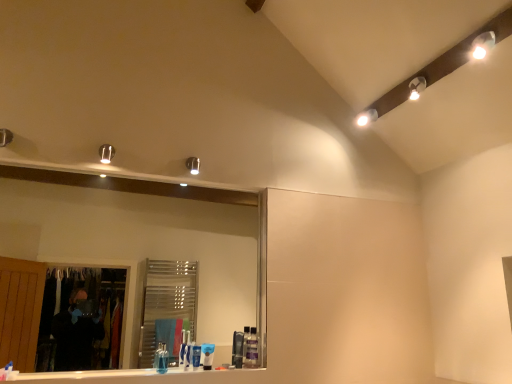
Question: From a real-world perspective, is translucent plastic container at lower center, placed as the first toiletry when sorted from right to left, physically located above or below white glossy light fixture at upper right?

Choices:
 (A) below
 (B) above

Answer: (A)

Question: Is translucent plastic container at lower center, which ranks as the fourth toiletry in left-to-right order, to the left or to the right of white glossy light fixture at upper right in the image?

Choices:
 (A) right
 (B) left

Answer: (B)

Question: Which object is the farthest from the white glossy toothpaste at lower left, marked as the second toothpaste in a back-to-front arrangement?

Choices:
 (A) white glossy toothpaste at lower center, arranged as the second toothpaste when viewed from the left
 (B) white glossy light fixture at upper right
 (C) blue glossy toothpaste tube at lower center, which is the 4th toiletry in right-to-left order
 (D) clear glass mirror at center
 (E) matte silver light fixture at upper left

Answer: (B)

Question: Considering the real-world distances, which object is farthest from the translucent plastic container at lower center, placed as the first toiletry when sorted from right to left?

Choices:
 (A) white glossy toothpaste at lower left, the 1th toothpaste viewed from the left
 (B) blue glossy toothpaste tube at lower center, which is the 4th toiletry in right-to-left order
 (C) blue matte toothpaste at center, the second toiletry from the left
 (D) translucent plastic soap dispenser at center, positioned as the 3th toiletry in left-to-right order
 (E) white glossy toothpaste at lower center, the 2th toothpaste when ordered from front to back

Answer: (A)